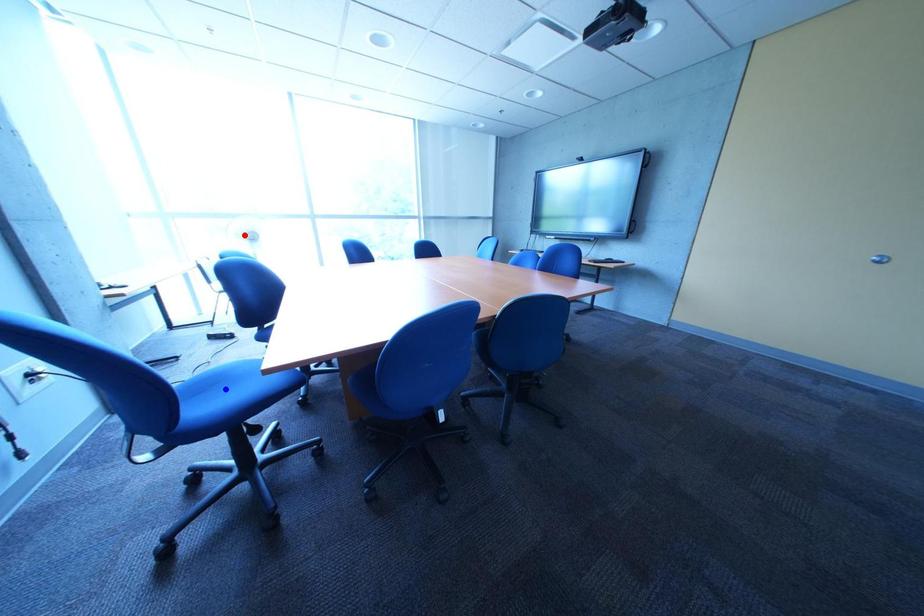
Question: Two points are marked on the image. Which point is closer to the camera?

Choices:
 (A) Blue point is closer.
 (B) Red point is closer.

Answer: (A)